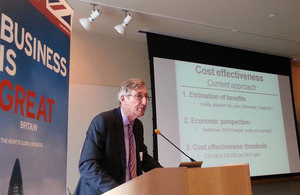
At what (x,y) coordinates should I click in order to perform the action: click on ceiling. Please return your answer as a coordinate pair (x, y). Looking at the image, I should click on tap(190, 8).